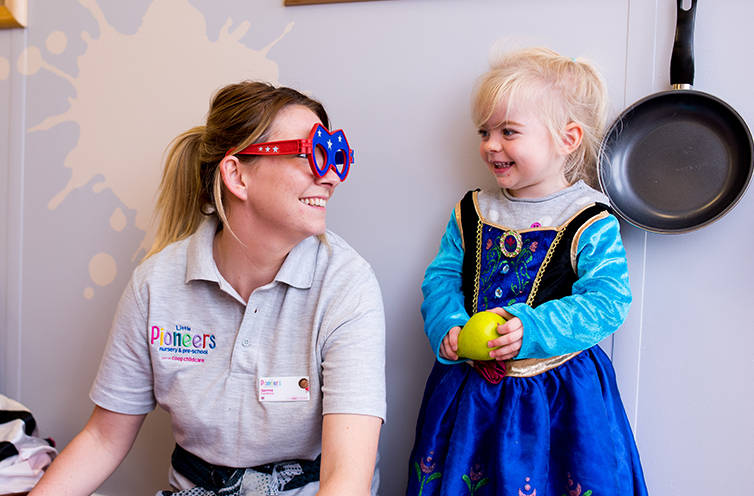
At what (x,y) coordinates should I click in order to perform the action: click on frying pan. Please return your answer as a coordinate pair (x, y). The image size is (754, 496). Looking at the image, I should click on (688, 168).